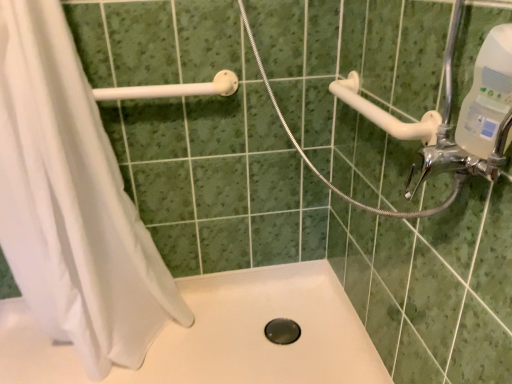
Question: Considering the relative positions of white matte bath at center and black rubber hole at center in the image provided, is white matte bath at center in front of black rubber hole at center?

Choices:
 (A) yes
 (B) no

Answer: (A)

Question: Is the depth of white matte bath at center greater than that of black rubber hole at center?

Choices:
 (A) no
 (B) yes

Answer: (A)

Question: Is white matte bath at center completely or partially outside of black rubber hole at center?

Choices:
 (A) yes
 (B) no

Answer: (A)

Question: Is white matte bath at center shorter than black rubber hole at center?

Choices:
 (A) no
 (B) yes

Answer: (A)

Question: Is white matte bath at center far from black rubber hole at center?

Choices:
 (A) no
 (B) yes

Answer: (A)

Question: Considering the relative sizes of white matte bath at center and black rubber hole at center in the image provided, is white matte bath at center thinner than black rubber hole at center?

Choices:
 (A) no
 (B) yes

Answer: (A)

Question: Is chrome metallic faucet at upper right thinner than white fabric shower curtain at left?

Choices:
 (A) yes
 (B) no

Answer: (A)

Question: From a real-world perspective, is chrome metallic faucet at upper right under white fabric shower curtain at left?

Choices:
 (A) yes
 (B) no

Answer: (B)

Question: From the image's perspective, is chrome metallic faucet at upper right located beneath white fabric shower curtain at left?

Choices:
 (A) yes
 (B) no

Answer: (B)

Question: Considering the relative sizes of chrome metallic faucet at upper right and white fabric shower curtain at left in the image provided, is chrome metallic faucet at upper right smaller than white fabric shower curtain at left?

Choices:
 (A) yes
 (B) no

Answer: (A)

Question: Is chrome metallic faucet at upper right shorter than white fabric shower curtain at left?

Choices:
 (A) yes
 (B) no

Answer: (A)

Question: Could you tell me if chrome metallic faucet at upper right is facing white fabric shower curtain at left?

Choices:
 (A) no
 (B) yes

Answer: (A)

Question: Is white fabric shower curtain at left aimed at white matte bath at center?

Choices:
 (A) yes
 (B) no

Answer: (B)